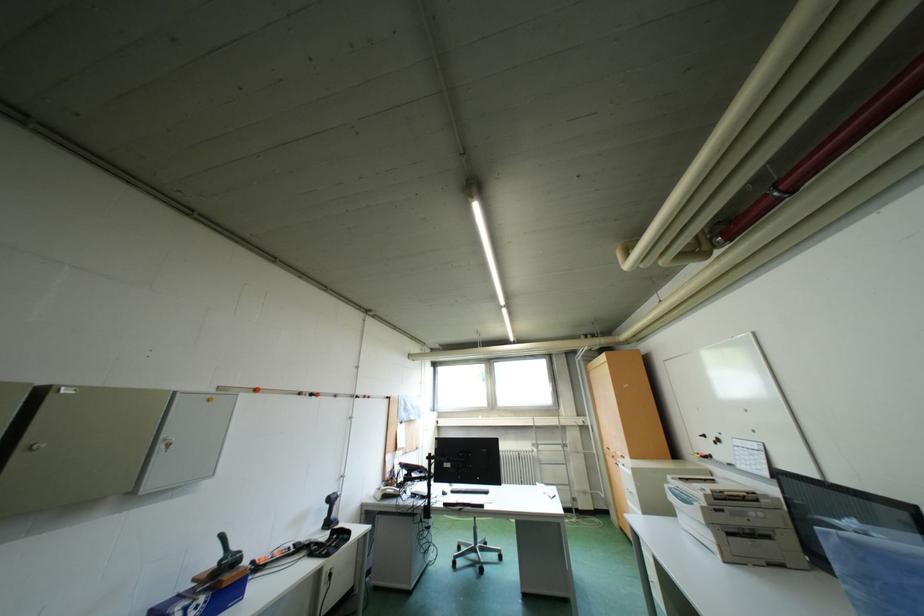
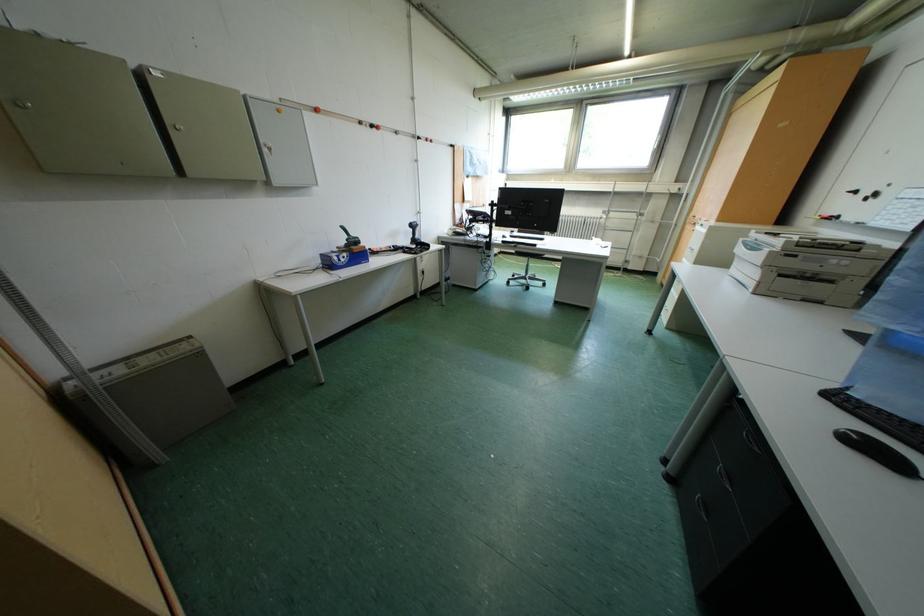
The images are taken continuously from a first-person perspective. In which direction is your viewpoint rotating?

The rotation direction of the camera is left-down.